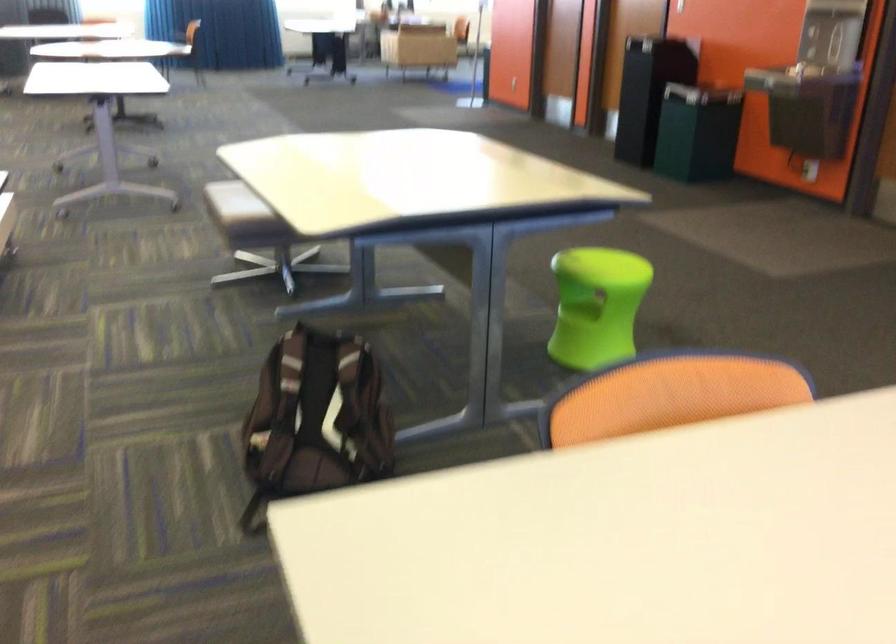
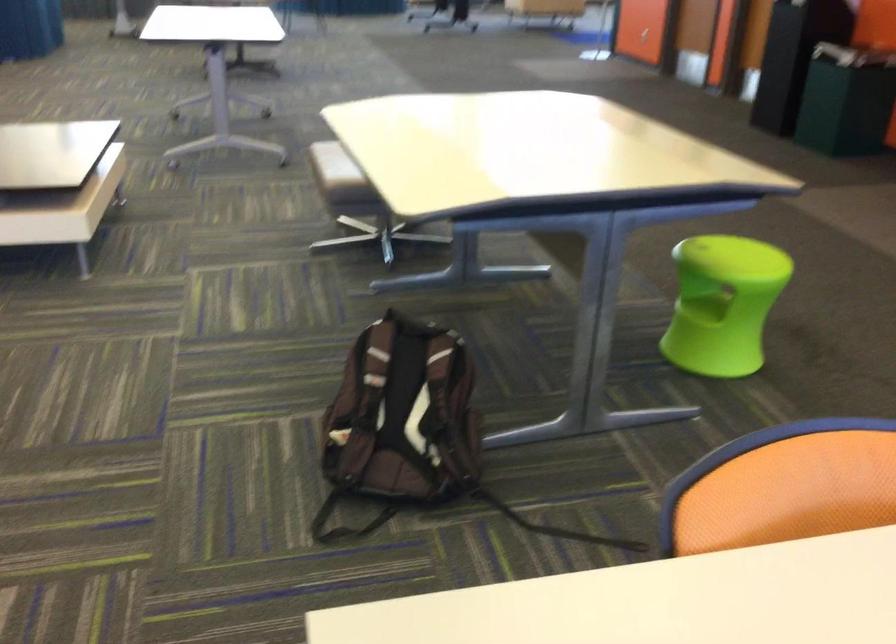
The point at (x=601, y=258) is marked in the first image. Where is the corresponding point in the second image?

(730, 247)